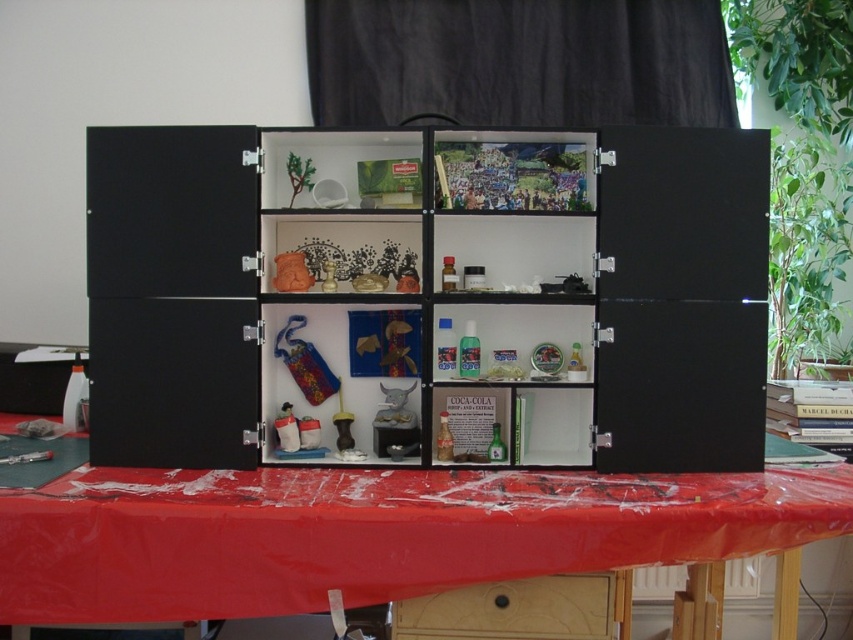
You are setting up a display and need to place a large decorative item. You have a red plastic table at center and a matte orange vase at center available. Which object should you choose if you want the base to be larger?

The red plastic table at center is bigger than the matte orange vase at center, so you should choose the red plastic table at center as the base since it is larger.

You are trying to place a tall vase on the red plastic table at center. However, you notice the wooden drawer at lower center is in the way. Can you move the vase to the table without removing the drawer?

The red plastic table at center is taller than the wooden drawer at lower center, so yes, you can move the vase to the table without removing the drawer since the table is higher up and the drawer is lower down.